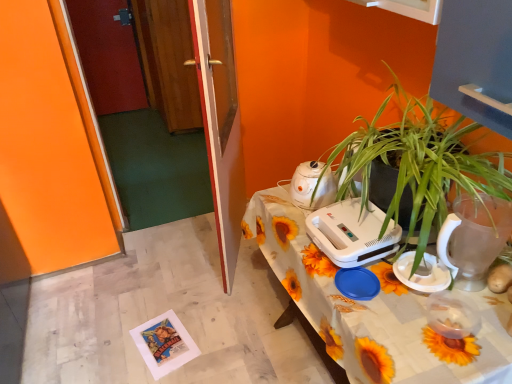
The image size is (512, 384). In order to click on free space to the left of transparent glass door at center, which is the 1th glass door from front to back in this screenshot , I will do `click(166, 261)`.